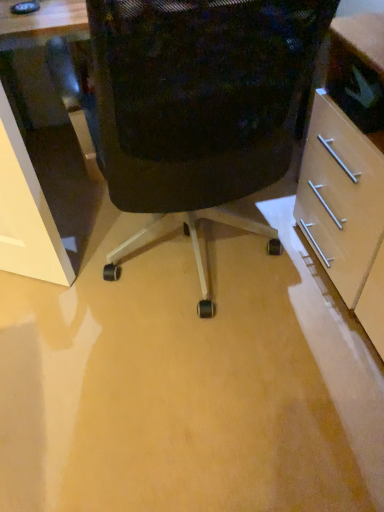
Measure the distance between point (233, 165) and camera.

Point (233, 165) and camera are 1.10 meters apart.

The image size is (384, 512). Describe the element at coordinates (193, 106) in the screenshot. I see `black mesh chair at center` at that location.

Where is `black mesh chair at center`? black mesh chair at center is located at coordinates (193, 106).

Where is `black mesh chair at center`? Image resolution: width=384 pixels, height=512 pixels. black mesh chair at center is located at coordinates (193, 106).